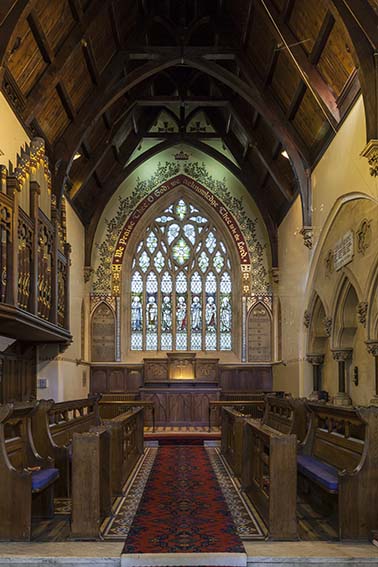
I want to click on back of pew, so click(81, 408), click(13, 422), click(339, 418), click(283, 408).